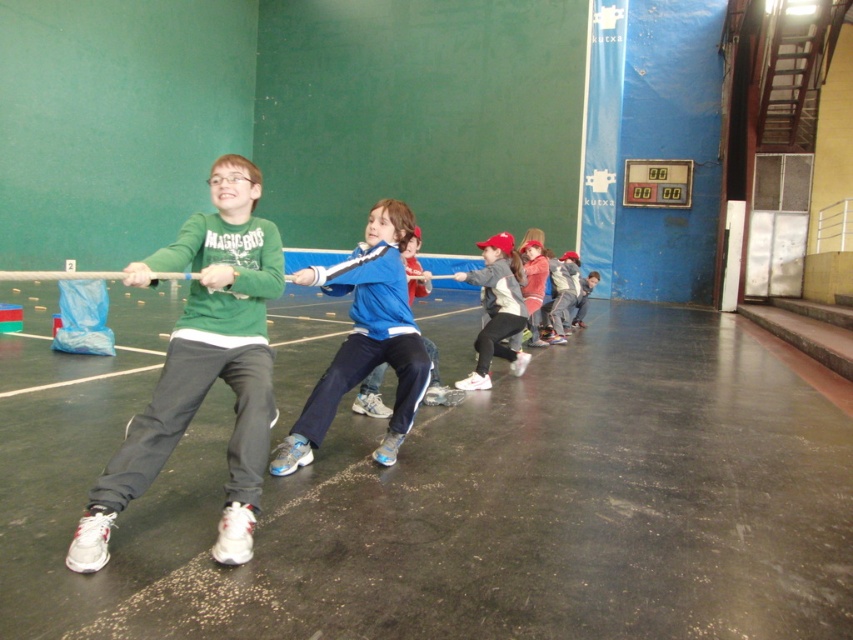
You are a GUI agent. You are given a task and a screenshot of the screen. Output one action in this format:
    pyautogui.click(x=<x>, y=<y>)
    Task: Click on the blue fabric jacket at center
    This screenshot has height=640, width=853.
    Given the screenshot: What is the action you would take?
    pyautogui.click(x=560, y=292)

Between blue fabric jacket at center and blue fabric pants at center, which one has less height?

blue fabric pants at center is shorter.

What do you see at coordinates (560, 292) in the screenshot? I see `blue fabric jacket at center` at bounding box center [560, 292].

What are the coordinates of `blue fabric jacket at center` in the screenshot? It's located at (560, 292).

Is green matte sweatshirt at left to the left of blue fabric pants at center from the viewer's perspective?

Correct, you'll find green matte sweatshirt at left to the left of blue fabric pants at center.

Does green matte sweatshirt at left appear over blue fabric pants at center?

No.

Is point (206, 330) in front of point (583, 280)?

Yes.

Find the location of a particular element. green matte sweatshirt at left is located at coordinates (202, 365).

Does white matte sneakers at center have a greater height compared to blue fabric jacket at center?

Correct, white matte sneakers at center is much taller as blue fabric jacket at center.

Which is below, white matte sneakers at center or blue fabric jacket at center?

white matte sneakers at center

Which is in front, point (476, 349) or point (560, 328)?

Point (476, 349) is in front.

This screenshot has width=853, height=640. What are the coordinates of `white matte sneakers at center` in the screenshot? It's located at (496, 308).